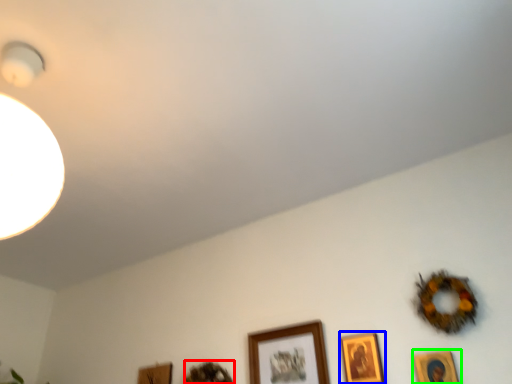
Question: Which is nearer to the picture frame (highlighted by a red box)? picture frame (highlighted by a blue box) or picture frame (highlighted by a green box).

Choices:
 (A) picture frame
 (B) picture frame

Answer: (A)